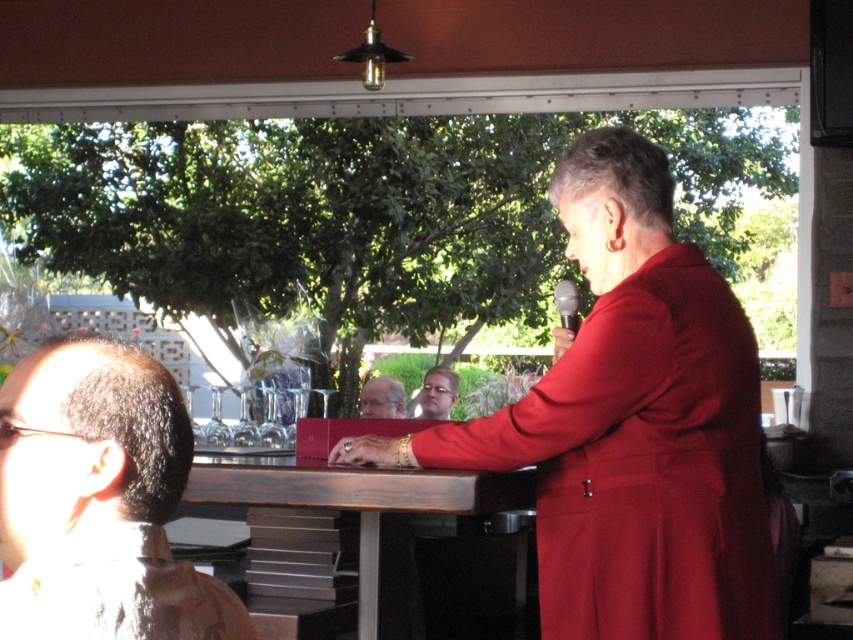
Does brown hair at left have a lesser width compared to brown wood table at center?

Indeed, brown hair at left has a lesser width compared to brown wood table at center.

Does point (167, 456) lie behind point (384, 563)?

No, it is not.

Describe the element at coordinates (97, 500) in the screenshot. The width and height of the screenshot is (853, 640). I see `brown hair at left` at that location.

What are the coordinates of `brown hair at left` in the screenshot? It's located at (97, 500).

Which is below, matte red coat at center or brown hair at left?

brown hair at left is below.

The height and width of the screenshot is (640, 853). What do you see at coordinates (631, 426) in the screenshot? I see `matte red coat at center` at bounding box center [631, 426].

Where is `matte red coat at center`? matte red coat at center is located at coordinates (631, 426).

Which is in front, point (103, 637) or point (402, 392)?

Positioned in front is point (103, 637).

This screenshot has width=853, height=640. What are the coordinates of `brown hair at left` in the screenshot? It's located at (97, 500).